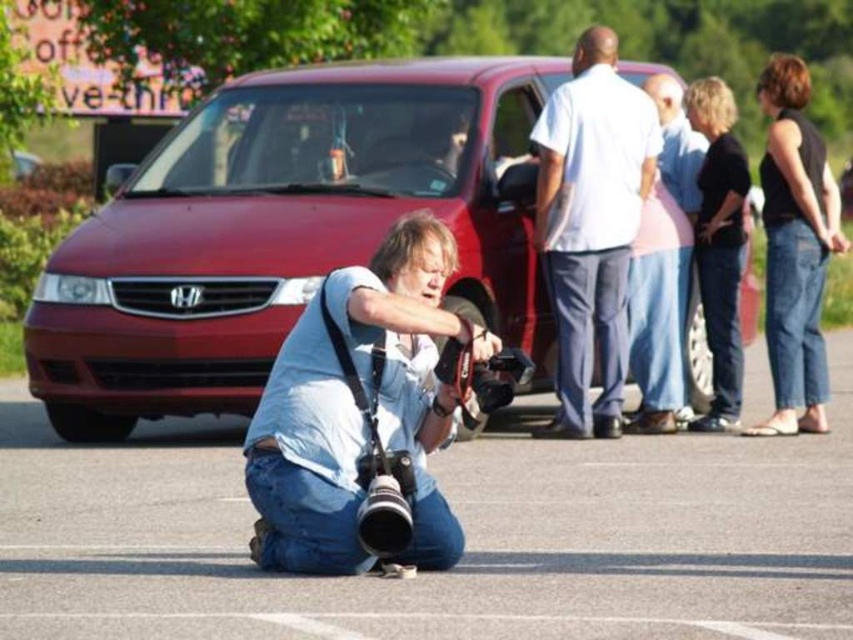
You are a photographer trying to decide whether to place a matte black camera at lower center in front of the pink cotton shirt at center. Based on their sizes, will the camera be fully visible if placed directly in front of the shirt?

The matte black camera at lower center is shorter than the pink cotton shirt at center, so placing it directly in front would still allow the camera to be fully visible since it is shorter and won

You are a photographer standing in a parking lot. You notice two people wearing shirts of different colors. The first person is wearing a pink cotton shirt at center, and the second is wearing a black cotton shirt at upper right. Which shirt is closer to you?

The pink cotton shirt at center is closer to the viewer than the black cotton shirt at upper right.

You are standing at the point marked as point (663, 268) in the image. What is the color of the shirt of the person nearest to you?

The point (663, 268) is on pink cotton shirt at center, so the nearest person to you is wearing a pink cotton shirt.